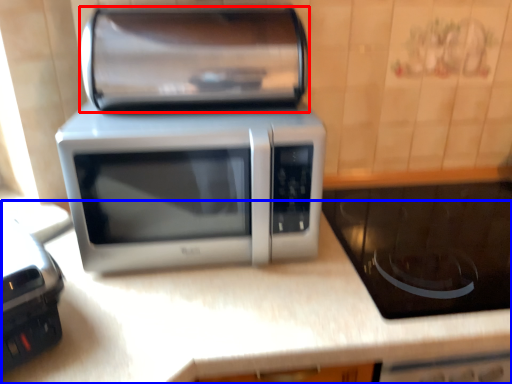
Question: Among these objects, which one is farthest to the camera, stereo (highlighted by a red box) or counter top (highlighted by a blue box)?

Choices:
 (A) stereo
 (B) counter top

Answer: (A)